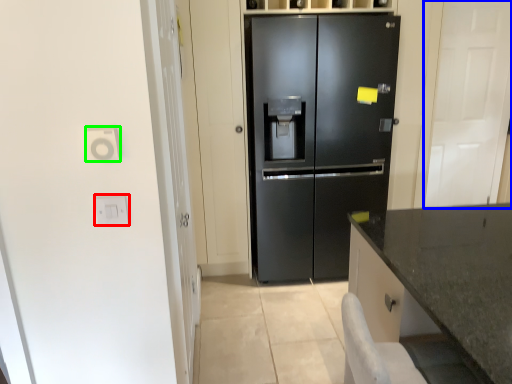
Question: Estimate the real-world distances between objects in this image. Which object is farther from electric outlet (highlighted by a red box), glass door (highlighted by a blue box) or electric outlet (highlighted by a green box)?

Choices:
 (A) glass door
 (B) electric outlet

Answer: (A)